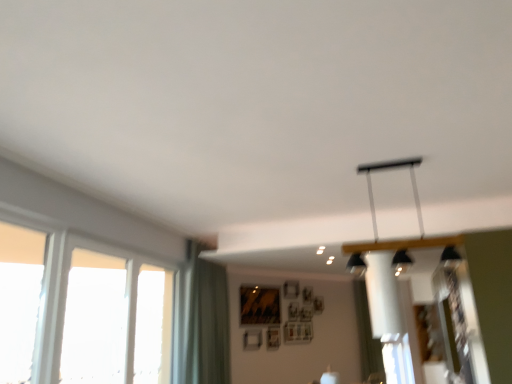
Question: Is transparent glass window at left, which is counted as the second window, starting from the right, wider than white fabric curtain at center, positioned as the second curtain in left-to-right order?

Choices:
 (A) no
 (B) yes

Answer: (A)

Question: From a real-world perspective, is transparent glass window at left, which is counted as the second window, starting from the right, below white fabric curtain at center, the 1th curtain from the back?

Choices:
 (A) yes
 (B) no

Answer: (B)

Question: Considering the relative positions of transparent glass window at left, which is counted as the second window, starting from the right, and white fabric curtain at center, positioned as the second curtain in left-to-right order, in the image provided, is transparent glass window at left, which is counted as the second window, starting from the right, to the left of white fabric curtain at center, positioned as the second curtain in left-to-right order, from the viewer's perspective?

Choices:
 (A) yes
 (B) no

Answer: (A)

Question: Is transparent glass window at left, which is counted as the second window, starting from the right, to the right of white fabric curtain at center, the 2th curtain from the front, from the viewer's perspective?

Choices:
 (A) yes
 (B) no

Answer: (B)

Question: Is transparent glass window at left, which is counted as the second window, starting from the right, located outside white fabric curtain at center, the 1th curtain from the back?

Choices:
 (A) no
 (B) yes

Answer: (B)

Question: Considering the positions of green fabric curtain at lower left, the first curtain viewed from the front, and white fabric curtain at center, the 1th curtain from the back, in the image, is green fabric curtain at lower left, the first curtain viewed from the front, wider or thinner than white fabric curtain at center, the 1th curtain from the back,?

Choices:
 (A) wide
 (B) thin

Answer: (A)

Question: Is green fabric curtain at lower left, arranged as the 2th curtain when viewed from the right, bigger or smaller than white fabric curtain at center, the 1th curtain from the back?

Choices:
 (A) big
 (B) small

Answer: (A)

Question: Is green fabric curtain at lower left, the second curtain from the back, taller or shorter than white fabric curtain at center, the 1th curtain from the right?

Choices:
 (A) tall
 (B) short

Answer: (B)

Question: Is point (197, 349) closer or farther from the camera than point (373, 344)?

Choices:
 (A) closer
 (B) farther

Answer: (A)

Question: Is clear glass window at left, placed as the first window when sorted from right to left, inside the boundaries of green fabric curtain at lower left, the 1th curtain in the left-to-right sequence, or outside?

Choices:
 (A) inside
 (B) outside

Answer: (B)

Question: Considering the positions of clear glass window at left, the 3th window viewed from the left, and green fabric curtain at lower left, arranged as the 2th curtain when viewed from the right, in the image, is clear glass window at left, the 3th window viewed from the left, wider or thinner than green fabric curtain at lower left, arranged as the 2th curtain when viewed from the right,?

Choices:
 (A) wide
 (B) thin

Answer: (B)

Question: Based on their positions, is clear glass window at left, the 3th window viewed from the left, located to the left or right of green fabric curtain at lower left, arranged as the 2th curtain when viewed from the right?

Choices:
 (A) right
 (B) left

Answer: (B)

Question: From the image's perspective, is clear glass window at left, the 3th window viewed from the left, positioned above or below green fabric curtain at lower left, arranged as the 2th curtain when viewed from the right?

Choices:
 (A) below
 (B) above

Answer: (B)

Question: From a real-world perspective, is green fabric curtain at lower left, arranged as the 2th curtain when viewed from the right, positioned above or below clear glass window at left, the 3th window viewed from the left?

Choices:
 (A) above
 (B) below

Answer: (A)

Question: Considering the positions of green fabric curtain at lower left, the first curtain viewed from the front, and clear glass window at left, the 3th window viewed from the left, in the image, is green fabric curtain at lower left, the first curtain viewed from the front, taller or shorter than clear glass window at left, the 3th window viewed from the left,?

Choices:
 (A) short
 (B) tall

Answer: (B)